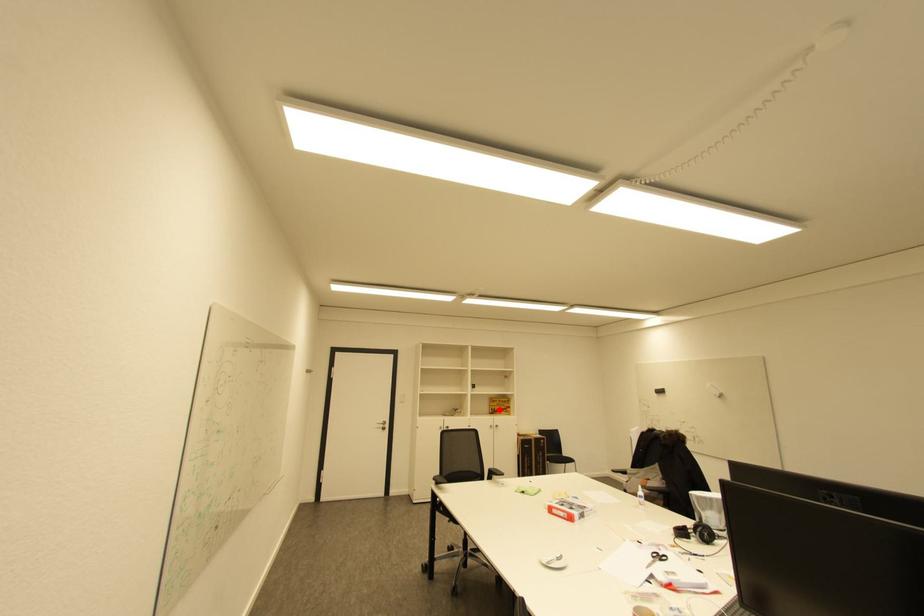
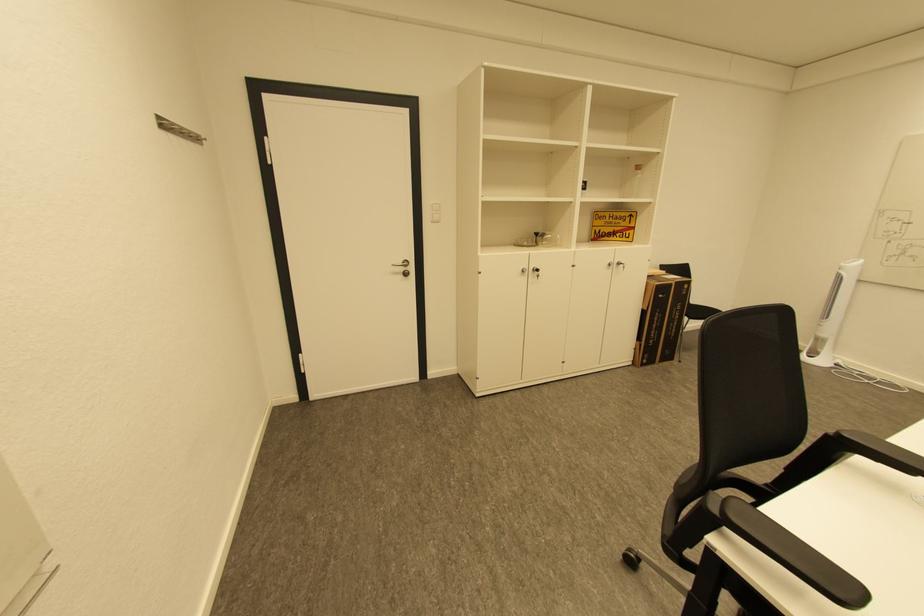
Find the pixel in the second image that matches the highlighted location in the first image.

(603, 233)